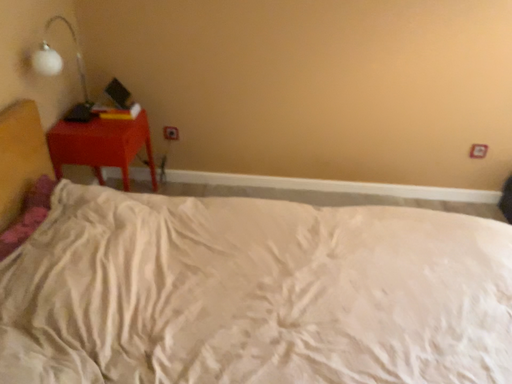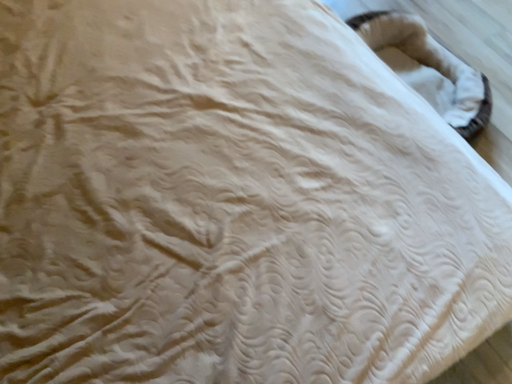
Question: How did the camera likely rotate when shooting the video?

Choices:
 (A) rotated upward
 (B) rotated downward

Answer: (B)